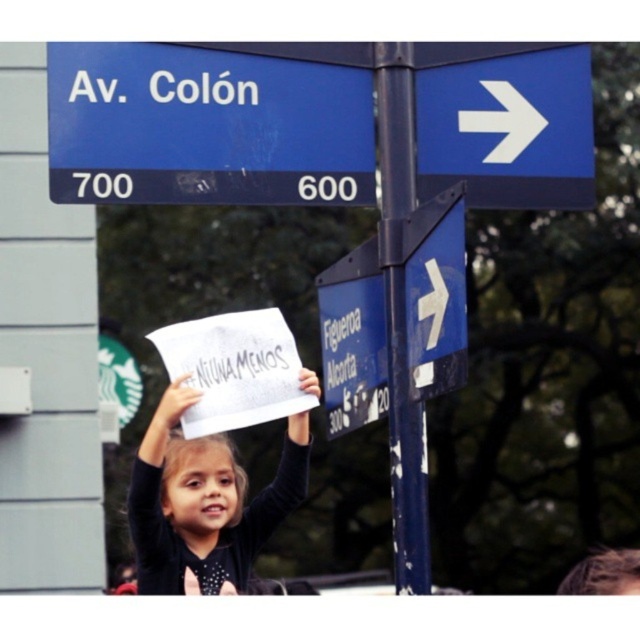
Can you confirm if dark blue shirt at center is positioned to the left of blue plastic sign at center right?

Correct, you'll find dark blue shirt at center to the left of blue plastic sign at center right.

Which is above, dark blue shirt at center or blue plastic sign at center right?

blue plastic sign at center right is above.

Does point (182, 500) lie behind point (464, 268)?

Yes, it is behind point (464, 268).

Find the location of a particular element. dark blue shirt at center is located at coordinates (204, 502).

Consider the image. Between blue plastic arrow at upper right and blue plastic sign at center right, which one is positioned higher?

blue plastic arrow at upper right is higher up.

Can you confirm if blue plastic arrow at upper right is taller than blue plastic sign at center right?

No, blue plastic arrow at upper right is not taller than blue plastic sign at center right.

Locate an element on the screen. The width and height of the screenshot is (640, 640). blue plastic arrow at upper right is located at coordinates (508, 129).

Measure the distance between blue plastic street sign at upper left and camera.

blue plastic street sign at upper left is 28.48 meters away from camera.

Can you confirm if blue plastic street sign at upper left is shorter than blue painted metal pole at right?

Yes, blue plastic street sign at upper left is shorter than blue painted metal pole at right.

Is point (300, 129) positioned before point (401, 65)?

Yes, point (300, 129) is closer to viewer.

Where is `blue plastic street sign at upper left`? Image resolution: width=640 pixels, height=640 pixels. blue plastic street sign at upper left is located at coordinates (205, 125).